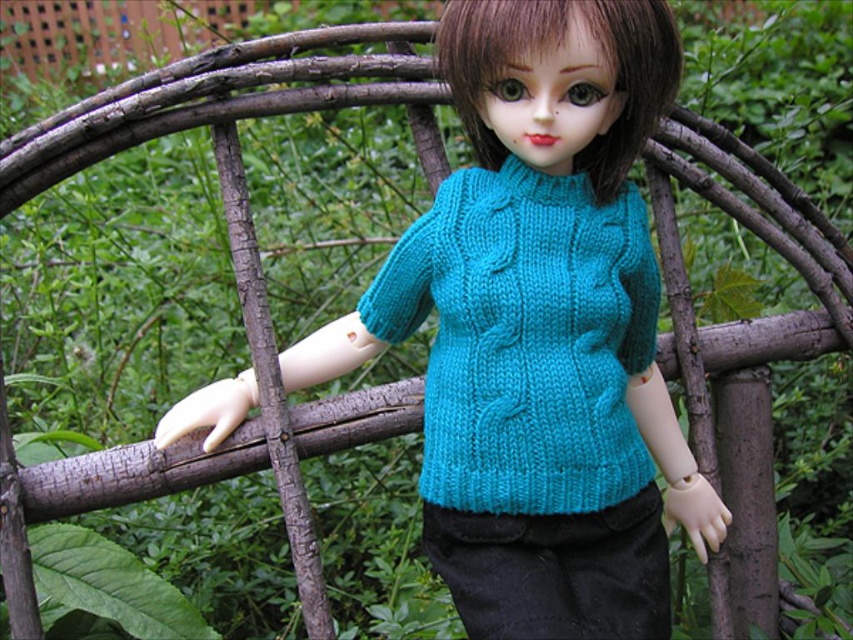
Is teal knitted sweater at center positioned in front of turquoise knitted sweater at center?

Yes, it is in front of turquoise knitted sweater at center.

The height and width of the screenshot is (640, 853). Find the location of `teal knitted sweater at center`. teal knitted sweater at center is located at coordinates pos(541,328).

Locate an element on the screen. The width and height of the screenshot is (853, 640). teal knitted sweater at center is located at coordinates (541, 328).

In order to click on teal knitted sweater at center in this screenshot , I will do `click(541, 328)`.